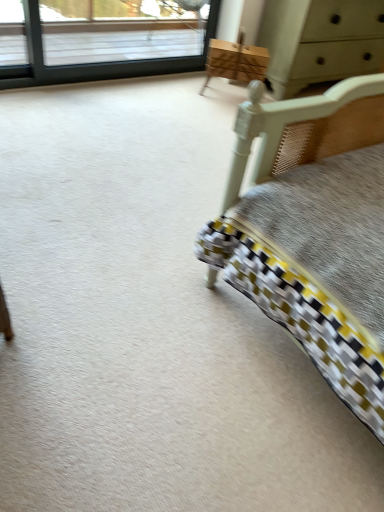
Where is `light gray wood dresser at upper right`? This screenshot has width=384, height=512. light gray wood dresser at upper right is located at coordinates (320, 41).

In order to face light gray wood dresser at upper right, should I rotate leftwards or rightwards?

To face it directly, rotate right by 18.125 degrees.

You are a GUI agent. You are given a task and a screenshot of the screen. Output one action in this format:
    pyautogui.click(x=<x>, y=<y>)
    Task: Click on the wooden chest of drawers at upper center
    Image resolution: width=384 pixels, height=512 pixels.
    Given the screenshot: What is the action you would take?
    pyautogui.click(x=236, y=62)

You are a GUI agent. You are given a task and a screenshot of the screen. Output one action in this format:
    pyautogui.click(x=<x>, y=<y>)
    Task: Click on the light gray wood dresser at upper right
    The width and height of the screenshot is (384, 512).
    Given the screenshot: What is the action you would take?
    point(320,41)

Is light gray wood dresser at upper right located outside wooden chest of drawers at upper center?

Absolutely, light gray wood dresser at upper right is external to wooden chest of drawers at upper center.

In order to click on furniture that appears below the light gray wood dresser at upper right (from the image's perspective) in this screenshot , I will do `click(236, 62)`.

Considering the sizes of objects light gray wood dresser at upper right and wooden chest of drawers at upper center in the image provided, who is thinner, light gray wood dresser at upper right or wooden chest of drawers at upper center?

wooden chest of drawers at upper center is thinner.

Looking at this image, from a real-world perspective, which is physically below, light gray wood dresser at upper right or wooden chest of drawers at upper center?

wooden chest of drawers at upper center, from a real-world perspective.

Relative to light gray wood dresser at upper right, is wooden chest of drawers at upper center in front or behind?

wooden chest of drawers at upper center is behind light gray wood dresser at upper right.

Is there a large distance between wooden chest of drawers at upper center and light gray wood dresser at upper right?

No, wooden chest of drawers at upper center is not far from light gray wood dresser at upper right.

From a real-world perspective, is wooden chest of drawers at upper center physically above light gray wood dresser at upper right?

Incorrect, from a real-world perspective, wooden chest of drawers at upper center is lower than light gray wood dresser at upper right.

Can you confirm if wooden chest of drawers at upper center is taller than light gray wood dresser at upper right?

No, wooden chest of drawers at upper center is not taller than light gray wood dresser at upper right.

Which of these two, clear glass window at upper left or light gray wood dresser at upper right, stands shorter?

clear glass window at upper left is shorter.

Looking at the image, does clear glass window at upper left seem bigger or smaller compared to light gray wood dresser at upper right?

Clearly, clear glass window at upper left is smaller in size than light gray wood dresser at upper right.

From a real-world perspective, is clear glass window at upper left located higher than light gray wood dresser at upper right?

No, from a real-world perspective, clear glass window at upper left is not over light gray wood dresser at upper right

Is clear glass window at upper left to the left or to the right of light gray wood dresser at upper right in the image?

clear glass window at upper left is positioned on light gray wood dresser at upper right's left side.

Between light gray wood dresser at upper right and clear glass window at upper left, which one is positioned in front?

clear glass window at upper left is closer to the camera.

Considering the relative positions of light gray wood dresser at upper right and clear glass window at upper left in the image provided, is light gray wood dresser at upper right to the right of clear glass window at upper left from the viewer's perspective?

Correct, you'll find light gray wood dresser at upper right to the right of clear glass window at upper left.

Which of these two, light gray wood dresser at upper right or clear glass window at upper left, is bigger?

With larger size is light gray wood dresser at upper right.

From a real-world perspective, relative to clear glass window at upper left, is light gray wood dresser at upper right vertically above or below?

light gray wood dresser at upper right is above clear glass window at upper left.

Is clear glass window at upper left far away from wooden chest of drawers at upper center?

They are positioned close to each other.

Between clear glass window at upper left and wooden chest of drawers at upper center, which one has less height?

With less height is wooden chest of drawers at upper center.

From a real-world perspective, is clear glass window at upper left over wooden chest of drawers at upper center?

Yes, from a real-world perspective, clear glass window at upper left is on top of wooden chest of drawers at upper center.

Is clear glass window at upper left aimed at wooden chest of drawers at upper center?

Yes, clear glass window at upper left faces towards wooden chest of drawers at upper center.

Is wooden chest of drawers at upper center placed right next to clear glass window at upper left?

No, wooden chest of drawers at upper center is not beside clear glass window at upper left.

From the image's perspective, who appears lower, wooden chest of drawers at upper center or clear glass window at upper left?

From the image's view, wooden chest of drawers at upper center is below.

Does point (232, 62) appear closer or farther from the camera than point (81, 76)?

Point (232, 62) appears to be farther away from the viewer than point (81, 76).

Between wooden chest of drawers at upper center and clear glass window at upper left, which one has more height?

clear glass window at upper left is taller.

Where is `chest of drawers in front of the wooden chest of drawers at upper center`? The height and width of the screenshot is (512, 384). chest of drawers in front of the wooden chest of drawers at upper center is located at coordinates (320, 41).

Find the location of a particular element. Image resolution: width=384 pixels, height=512 pixels. furniture behind the light gray wood dresser at upper right is located at coordinates (236, 62).

Looking at the image, which one is located further to clear glass window at upper left, light gray wood dresser at upper right or wooden chest of drawers at upper center?

light gray wood dresser at upper right.

Looking at the image, which one is located further to light gray wood dresser at upper right, clear glass window at upper left or wooden chest of drawers at upper center?

clear glass window at upper left lies further to light gray wood dresser at upper right than the other object.

From the image, which object appears to be farther from clear glass window at upper left, wooden chest of drawers at upper center or light gray wood dresser at upper right?

light gray wood dresser at upper right is further to clear glass window at upper left.

From the image, which object appears to be nearer to wooden chest of drawers at upper center, light gray wood dresser at upper right or clear glass window at upper left?

light gray wood dresser at upper right is closer to wooden chest of drawers at upper center.

Which object lies nearer to the anchor point light gray wood dresser at upper right, wooden chest of drawers at upper center or clear glass window at upper left?

wooden chest of drawers at upper center is positioned closer to the anchor light gray wood dresser at upper right.

When comparing their distances from wooden chest of drawers at upper center, does clear glass window at upper left or light gray wood dresser at upper right seem further?

clear glass window at upper left is further to wooden chest of drawers at upper center.

Identify the location of furniture between clear glass window at upper left and light gray wood dresser at upper right in the horizontal direction. (236, 62).